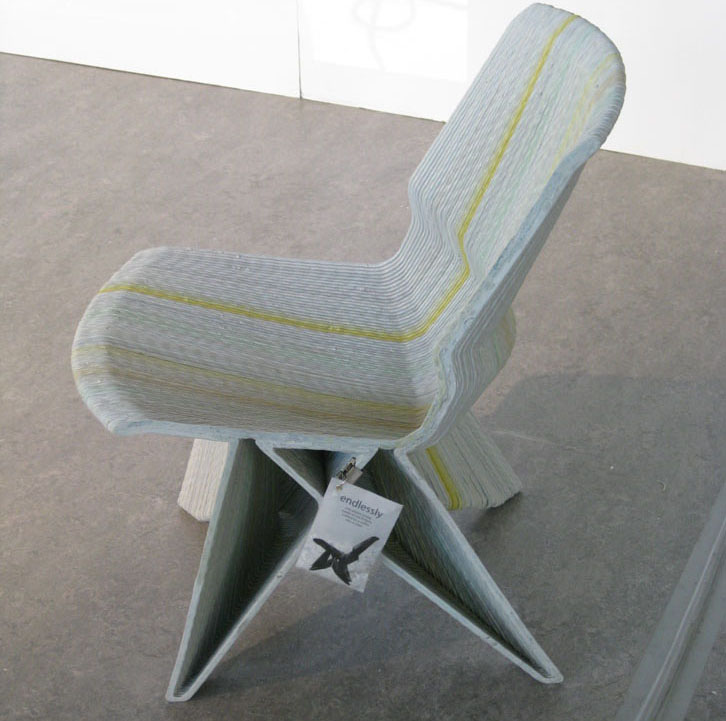
At what (x,y) coordinates should I click in order to perform the action: click on chair legs. Please return your answer as a coordinate pair (x, y). Looking at the image, I should click on (468, 597), (237, 577).